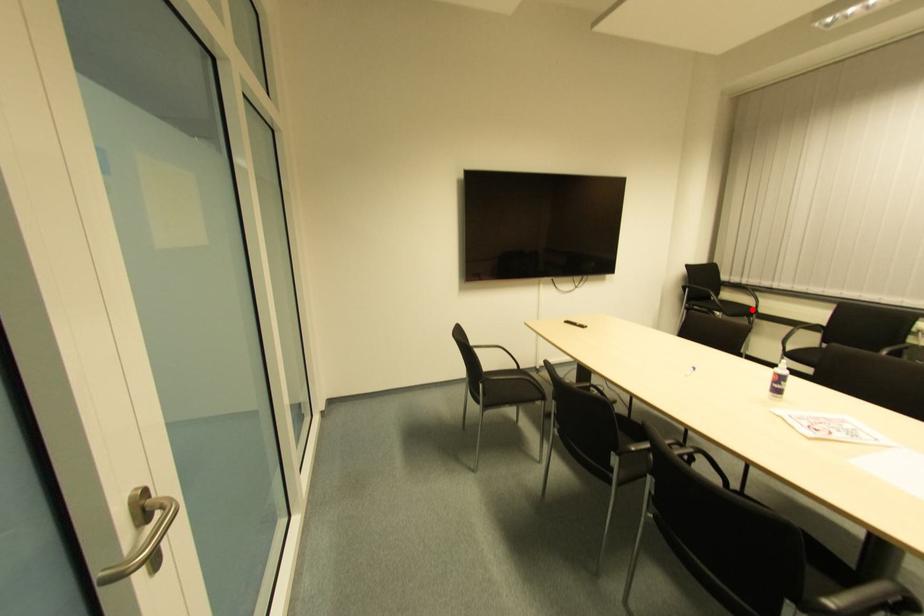
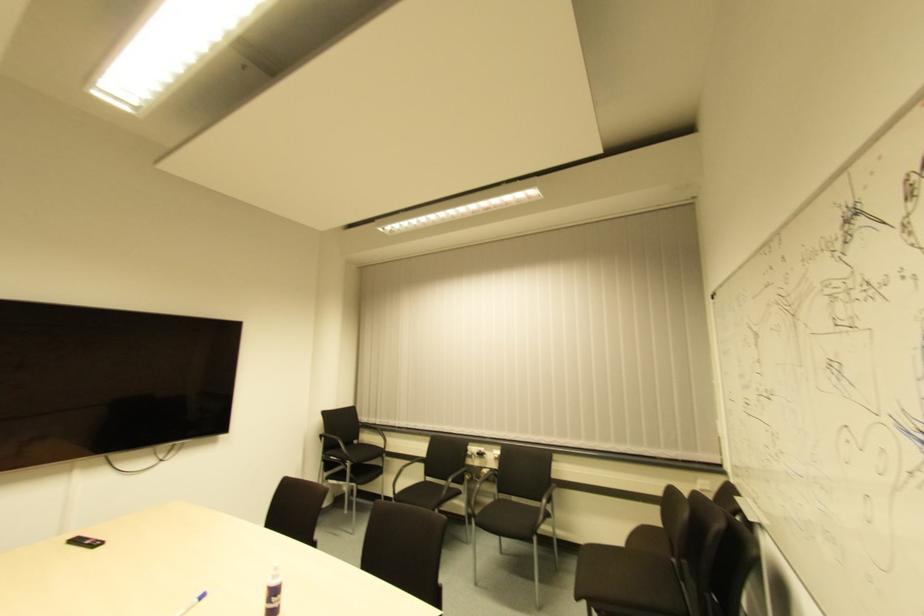
Locate, in the second image, the point that corresponds to the highlighted location in the first image.

(381, 448)